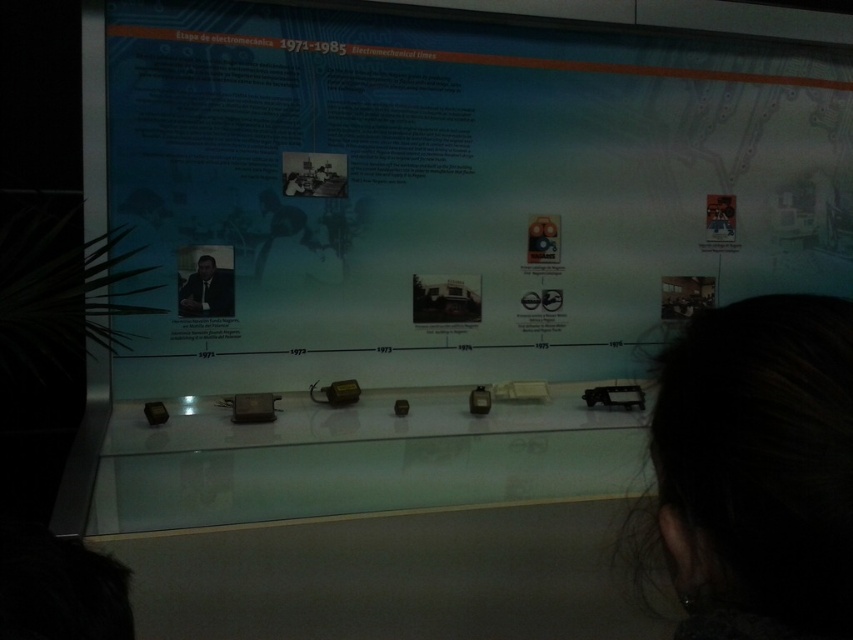
Question: Where is matte blue poster at center located in relation to dark brown hair at upper right in the image?

Choices:
 (A) right
 (B) left

Answer: (A)

Question: Among these points, which one is farthest from the camera?

Choices:
 (A) (689, 275)
 (B) (712, 502)
 (C) (202, 300)

Answer: (A)

Question: Which point is closer to the camera taking this photo?

Choices:
 (A) (814, 440)
 (B) (199, 272)

Answer: (A)

Question: Does matte blue poster at center appear under matte black suit at center?

Choices:
 (A) yes
 (B) no

Answer: (B)

Question: Is matte blue poster at center to the right of matte black suit at center from the viewer's perspective?

Choices:
 (A) yes
 (B) no

Answer: (A)

Question: Estimate the real-world distances between objects in this image. Which object is farther from the dark brown hair at upper right?

Choices:
 (A) matte black suit at center
 (B) matte blue poster at center

Answer: (B)